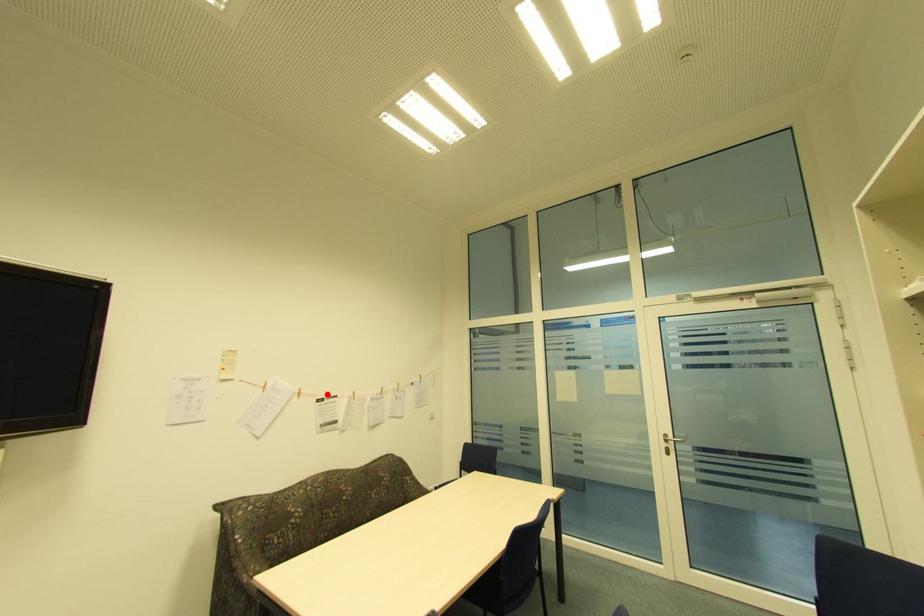
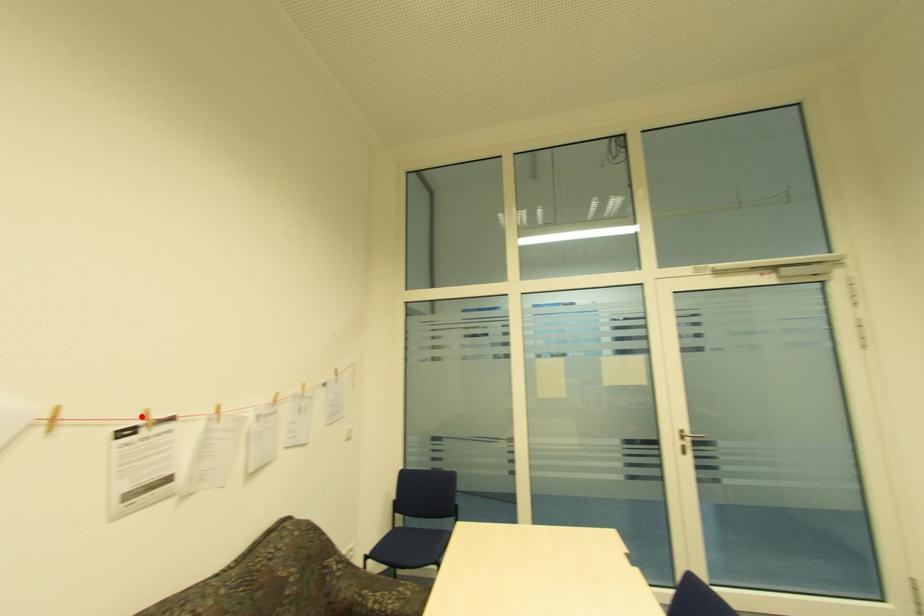
I am providing you with two images of the same scene from different viewpoints. A red point is marked on the first image and another point is marked on the second image. Is the red point in image1 aligned with the point shown in image2?

Yes